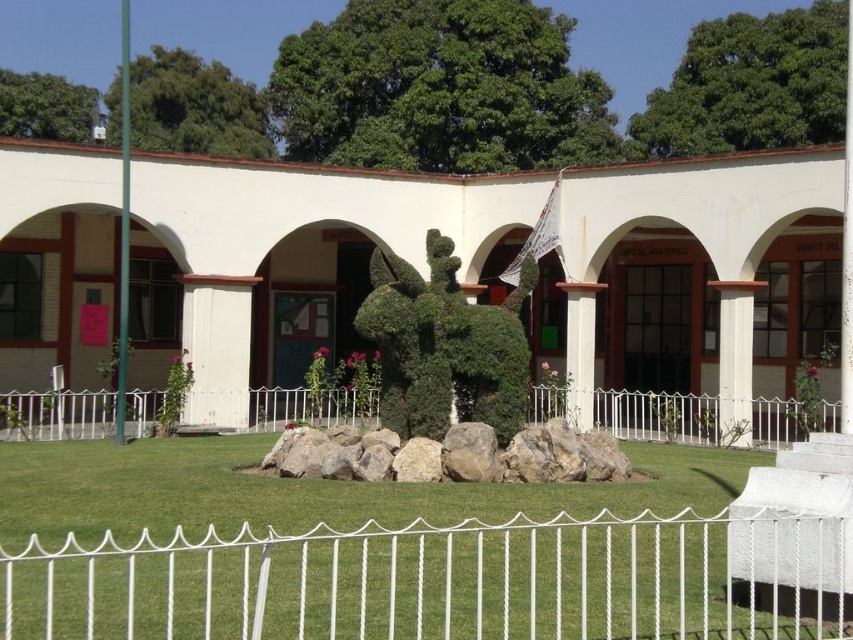
You are a gardener who needs to water the green leafy hedge at center and the gray rock at center. Since the watering can has a maximum reach of 36 inches, can you water both objects without moving the can?

The green leafy hedge at center is 38.63 inches away from gray rock at center. Since the watering can has a maximum reach of 36 inches, you cannot water both objects without moving the can because the distance between them exceeds the can reach.

You are standing at the entrance of the building and want to walk towards the white metal fence at center. Which direction should you head?

Since the white metal fence at center is located at point (708, 419), you should head towards the center of the lawn to reach it.

You are a gardener planning to water the plants in the scene. You see the white metal fence at center and the green leafy hedge at center. Which object is located to the left when viewed from the building?

The white metal fence at center is positioned on the left side of the green leafy hedge at center, so when viewed from the building, the white metal fence at center is to the left of the green leafy hedge at center.